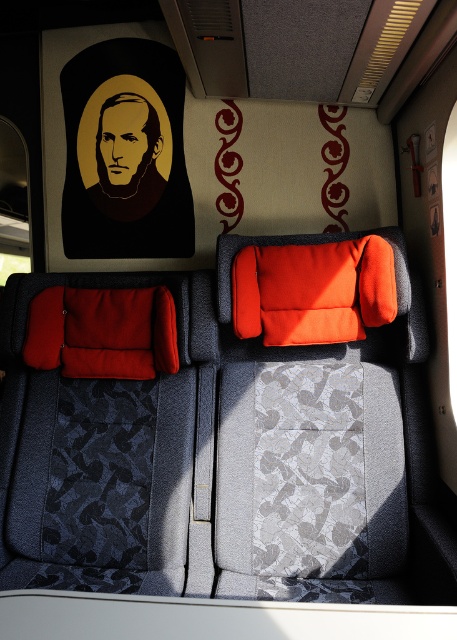
Question: Is the position of orange fabric pillow at center less distant than that of velvet red pillow at left?

Choices:
 (A) yes
 (B) no

Answer: (A)

Question: Among these points, which one is nearest to the camera?

Choices:
 (A) (132, 344)
 (B) (308, 316)

Answer: (B)

Question: Is orange fabric pillow at center further to camera compared to velvet red pillow at left?

Choices:
 (A) no
 (B) yes

Answer: (A)

Question: Among these points, which one is nearest to the camera?

Choices:
 (A) (371, 280)
 (B) (136, 348)

Answer: (A)

Question: Does orange fabric pillow at center appear over velvet red pillow at left?

Choices:
 (A) yes
 (B) no

Answer: (A)